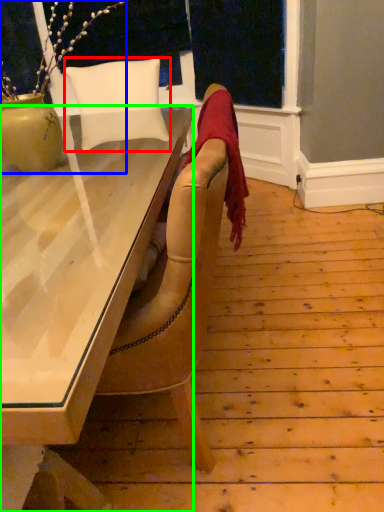
Question: Estimate the real-world distances between objects in this image. Which object is farther from pillow (highlighted by a red box), houseplant (highlighted by a blue box) or desk (highlighted by a green box)?

Choices:
 (A) houseplant
 (B) desk

Answer: (B)